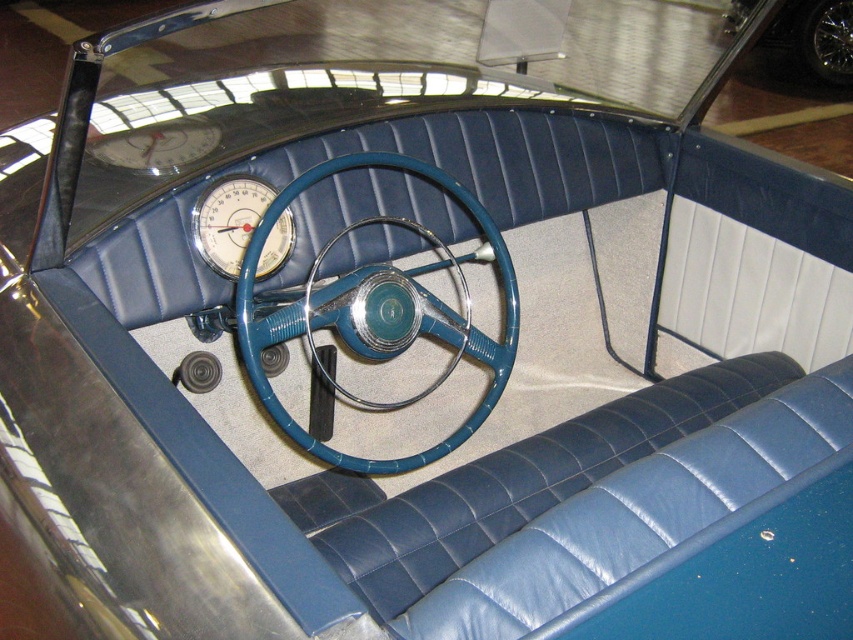
Is metallic silver gauge at center closer to camera compared to metallic silver wheel at center?

Yes, metallic silver gauge at center is in front of metallic silver wheel at center.

Describe the element at coordinates (228, 220) in the screenshot. I see `metallic silver gauge at center` at that location.

Between point (260, 248) and point (811, 16), which one is positioned behind?

The point (811, 16) is behind.

Where is `metallic silver gauge at center`? metallic silver gauge at center is located at coordinates (228, 220).

Can you confirm if blue metallic steering wheel at center is taller than metallic silver wheel at center?

Incorrect, blue metallic steering wheel at center's height is not larger of metallic silver wheel at center's.

Looking at this image, who is positioned more to the right, blue metallic steering wheel at center or metallic silver wheel at center?

metallic silver wheel at center

The image size is (853, 640). What do you see at coordinates (453, 324) in the screenshot?
I see `blue metallic steering wheel at center` at bounding box center [453, 324].

I want to click on blue metallic steering wheel at center, so click(x=453, y=324).

Does blue textured steering wheel at center have a greater height compared to blue metallic steering wheel at center?

Indeed, blue textured steering wheel at center has a greater height compared to blue metallic steering wheel at center.

Can you confirm if blue textured steering wheel at center is positioned below blue metallic steering wheel at center?

Incorrect, blue textured steering wheel at center is not positioned below blue metallic steering wheel at center.

Who is more distant from viewer, [399,308] or [434,387]?

Positioned behind is point [434,387].

You are a GUI agent. You are given a task and a screenshot of the screen. Output one action in this format:
    pyautogui.click(x=<x>, y=<y>)
    Task: Click on the blue textured steering wheel at center
    
    Given the screenshot: What is the action you would take?
    pyautogui.click(x=375, y=316)